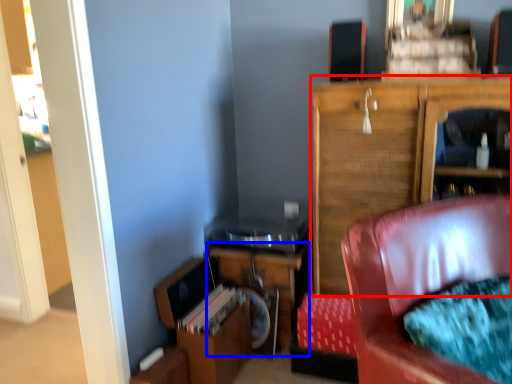
Question: Which object appears closest to the camera in this image, cabinetry (highlighted by a red box) or table (highlighted by a blue box)?

Choices:
 (A) cabinetry
 (B) table

Answer: (A)